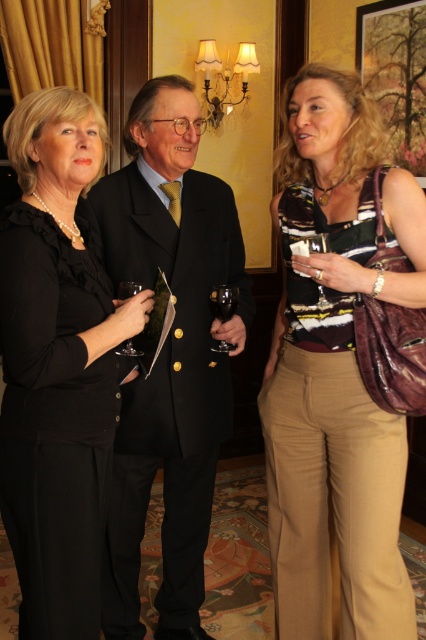
Question: Is black wool suit at center closer to the viewer compared to translucent glass at center?

Choices:
 (A) no
 (B) yes

Answer: (B)

Question: Which point is closer to the camera?

Choices:
 (A) transparent glass at center
 (B) black satin dress at left
 (C) black wool suit at center
 (D) striped jersey at center

Answer: (B)

Question: Which point is farther from the camera taking this photo?

Choices:
 (A) (112, 369)
 (B) (215, 291)

Answer: (B)

Question: Does black satin dress at left have a greater width compared to clear glass wine glass at center?

Choices:
 (A) yes
 (B) no

Answer: (A)

Question: Based on their relative distances, which object is nearer to the transparent glass at center?

Choices:
 (A) black satin dress at left
 (B) translucent glass at center
 (C) clear glass wine glass at center

Answer: (B)

Question: Can you confirm if black satin dress at left is bigger than transparent glass at center?

Choices:
 (A) no
 (B) yes

Answer: (B)